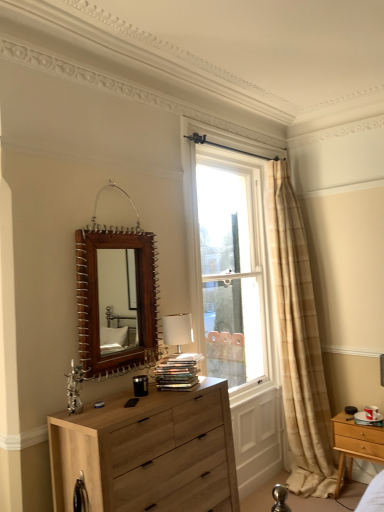
The height and width of the screenshot is (512, 384). In order to click on free point above brown wooden mirror at upper center (from a real-world perspective) in this screenshot , I will do `click(108, 178)`.